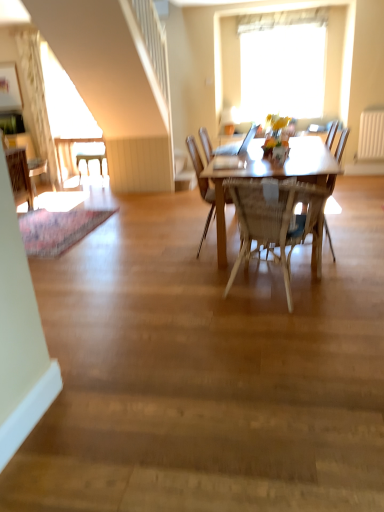
The image size is (384, 512). Identify the location of free space in front of woven wood chair at center, the 2th chair viewed from the right. (295, 326).